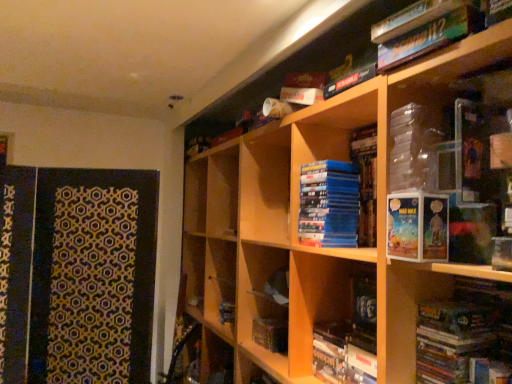
What is the approximate width of green cardboard book at upper right, acting as the first book starting from the top?

It is 15.15 inches.

What do you see at coordinates (349, 339) in the screenshot? I see `matte blue book at lower center, which is the fourth book in top-to-bottom order` at bounding box center [349, 339].

The height and width of the screenshot is (384, 512). What do you see at coordinates (355, 232) in the screenshot? I see `wooden bookcase at upper right` at bounding box center [355, 232].

Find the location of `green cardboard book at upper right, acting as the 4th book starting from the bottom`. green cardboard book at upper right, acting as the 4th book starting from the bottom is located at coordinates (426, 31).

Which point is more forward, (467, 316) or (357, 362)?

The point (467, 316) is closer to the camera.

Is matte black book at lower right, which ranks as the second book in bottom-to-top order, beside matte blue book at lower center, which is the fourth book in top-to-bottom order?

No, matte black book at lower right, which ranks as the second book in bottom-to-top order, is not beside matte blue book at lower center, which is the fourth book in top-to-bottom order.

Between matte black book at lower right, placed as the 3th book when sorted from top to bottom, and matte blue book at lower center, which is the fourth book in top-to-bottom order, which one has smaller size?

matte blue book at lower center, which is the fourth book in top-to-bottom order, is smaller.

From their relative heights in the image, would you say matte black book at lower right, which ranks as the second book in bottom-to-top order, is taller or shorter than matte blue book at lower center, which is the fourth book in top-to-bottom order?

matte black book at lower right, which ranks as the second book in bottom-to-top order, is taller than matte blue book at lower center, which is the fourth book in top-to-bottom order.

Could matte black book at lower right, placed as the 3th book when sorted from top to bottom, be considered to be inside matte cardboard book at center-right?

No, matte black book at lower right, placed as the 3th book when sorted from top to bottom, is not surrounded by matte cardboard book at center-right.

From the image's perspective, is matte cardboard book at center-right on matte black book at lower right, placed as the 3th book when sorted from top to bottom?

Yes, from the image's perspective, matte cardboard book at center-right is on top of matte black book at lower right, placed as the 3th book when sorted from top to bottom.

Which of these two, matte cardboard book at center-right or matte black book at lower right, which ranks as the second book in bottom-to-top order, is thinner?

With smaller width is matte black book at lower right, which ranks as the second book in bottom-to-top order.

Which of these two, blue matte dvd stack at center, acting as the third book starting from the bottom, or green cardboard book at upper right, acting as the first book starting from the top, is smaller?

green cardboard book at upper right, acting as the first book starting from the top, is smaller.

Would you say green cardboard book at upper right, acting as the first book starting from the top, is part of blue matte dvd stack at center, acting as the third book starting from the bottom,'s contents?

No, green cardboard book at upper right, acting as the first book starting from the top, is not a part of blue matte dvd stack at center, acting as the third book starting from the bottom.

Which is behind, blue matte dvd stack at center, placed as the second book when sorted from top to bottom, or green cardboard book at upper right, acting as the 4th book starting from the bottom?

blue matte dvd stack at center, placed as the second book when sorted from top to bottom, is more distant.

From the image's perspective, which book is the 1st one below the green cardboard book at upper right, acting as the 4th book starting from the bottom? Please provide its 2D coordinates.

[(366, 182)]

Is matte blue book at lower center, the 1th book positioned from the bottom, completely or partially inside wooden bookcase at upper right?

Yes, matte blue book at lower center, the 1th book positioned from the bottom, is a part of wooden bookcase at upper right.

Is point (470, 353) farther from viewer compared to point (352, 358)?

No, (470, 353) is in front of (352, 358).

Does wooden bookcase at upper right have a greater width compared to matte blue book at lower center, which is the fourth book in top-to-bottom order?

Indeed, wooden bookcase at upper right has a greater width compared to matte blue book at lower center, which is the fourth book in top-to-bottom order.

From the image's perspective, is wooden bookcase at upper right above or below matte blue book at lower center, the 1th book positioned from the bottom?

wooden bookcase at upper right is situated higher than matte blue book at lower center, the 1th book positioned from the bottom, in the image.

Does green cardboard book at upper right, acting as the 4th book starting from the bottom, have a lesser width compared to matte blue book at lower center, which is the fourth book in top-to-bottom order?

In fact, green cardboard book at upper right, acting as the 4th book starting from the bottom, might be wider than matte blue book at lower center, which is the fourth book in top-to-bottom order.

Is green cardboard book at upper right, acting as the first book starting from the top, aimed at matte blue book at lower center, the 1th book positioned from the bottom?

No, green cardboard book at upper right, acting as the first book starting from the top, is not oriented towards matte blue book at lower center, the 1th book positioned from the bottom.

From a real-world perspective, is green cardboard book at upper right, acting as the first book starting from the top, under matte blue book at lower center, the 1th book positioned from the bottom?

No, from a real-world perspective, green cardboard book at upper right, acting as the first book starting from the top, is not beneath matte blue book at lower center, the 1th book positioned from the bottom.

Consider the image. Between green cardboard book at upper right, acting as the 4th book starting from the bottom, and matte blue book at lower center, the 1th book positioned from the bottom, which one has smaller size?

With smaller size is matte blue book at lower center, the 1th book positioned from the bottom.

From the image's perspective, which is above, matte blue book at lower center, the 1th book positioned from the bottom, or blue matte dvd stack at center, acting as the third book starting from the bottom?

blue matte dvd stack at center, acting as the third book starting from the bottom, from the image's perspective.

Between point (366, 354) and point (355, 157), which one is positioned in front?

The point (366, 354) is closer.

From the picture: Could you tell me if matte blue book at lower center, which is the fourth book in top-to-bottom order, is turned towards blue matte dvd stack at center, placed as the second book when sorted from top to bottom?

No.

Does blue matte dvd stack at center, acting as the third book starting from the bottom, have a lesser width compared to matte black book at lower right, placed as the 3th book when sorted from top to bottom?

In fact, blue matte dvd stack at center, acting as the third book starting from the bottom, might be wider than matte black book at lower right, placed as the 3th book when sorted from top to bottom.

From a real-world perspective, is blue matte dvd stack at center, placed as the second book when sorted from top to bottom, located beneath matte black book at lower right, which ranks as the second book in bottom-to-top order?

Actually, blue matte dvd stack at center, placed as the second book when sorted from top to bottom, is physically above matte black book at lower right, which ranks as the second book in bottom-to-top order, in the real world.

Is blue matte dvd stack at center, acting as the third book starting from the bottom, aimed at matte black book at lower right, placed as the 3th book when sorted from top to bottom?

No, blue matte dvd stack at center, acting as the third book starting from the bottom, is not aimed at matte black book at lower right, placed as the 3th book when sorted from top to bottom.

In order to click on the 1st book above the matte blue book at lower center, which is the fourth book in top-to-bottom order (from the image's perspective) in this screenshot , I will do `click(463, 330)`.

Locate an element on the screen. This screenshot has width=512, height=384. the 1st book positioned below the matte cardboard book at center-right (from the image's perspective) is located at coordinates (463, 330).

Looking at the image, which one is located closer to blue matte dvd stack at center, placed as the second book when sorted from top to bottom, matte cardboard book at center-right or wooden bookcase at upper right?

Among the two, wooden bookcase at upper right is located nearer to blue matte dvd stack at center, placed as the second book when sorted from top to bottom.

When comparing their distances from wooden bookcase at upper right, does matte blue book at lower center, the 1th book positioned from the bottom, or blue matte dvd stack at center, acting as the third book starting from the bottom, seem further?

Among the two, blue matte dvd stack at center, acting as the third book starting from the bottom, is located further to wooden bookcase at upper right.

Estimate the real-world distances between objects in this image. Which object is further from green cardboard book at upper right, acting as the 4th book starting from the bottom, matte cardboard book at center-right or matte blue book at lower center, the 1th book positioned from the bottom?

The object further to green cardboard book at upper right, acting as the 4th book starting from the bottom, is matte blue book at lower center, the 1th book positioned from the bottom.

When comparing their distances from matte black book at lower right, which ranks as the second book in bottom-to-top order, does matte blue book at lower center, which is the fourth book in top-to-bottom order, or blue matte dvd stack at center, placed as the second book when sorted from top to bottom, seem closer?

matte blue book at lower center, which is the fourth book in top-to-bottom order, is closer to matte black book at lower right, which ranks as the second book in bottom-to-top order.

Looking at the image, which one is located closer to green cardboard book at upper right, acting as the 4th book starting from the bottom, blue matte dvd stack at center, placed as the second book when sorted from top to bottom, or matte cardboard book at center-right?

Based on the image, matte cardboard book at center-right appears to be nearer to green cardboard book at upper right, acting as the 4th book starting from the bottom.

From the image, which object appears to be farther from matte black book at lower right, placed as the 3th book when sorted from top to bottom, matte blue book at lower center, the 1th book positioned from the bottom, or green cardboard book at upper right, acting as the first book starting from the top?

The object further to matte black book at lower right, placed as the 3th book when sorted from top to bottom, is green cardboard book at upper right, acting as the first book starting from the top.

When comparing their distances from wooden bookcase at upper right, does green cardboard book at upper right, acting as the first book starting from the top, or matte cardboard book at center-right seem closer?

matte cardboard book at center-right is closer to wooden bookcase at upper right.

Which object lies nearer to the anchor point matte cardboard book at center-right, blue matte dvd stack at center, placed as the second book when sorted from top to bottom, or matte blue book at lower center, the 1th book positioned from the bottom?

Among the two, matte blue book at lower center, the 1th book positioned from the bottom, is located nearer to matte cardboard book at center-right.

I want to click on paperback book between green cardboard book at upper right, acting as the 4th book starting from the bottom, and wooden bookcase at upper right in the up-down direction, so click(417, 227).

Where is `bookcase that lies between green cardboard book at upper right, acting as the first book starting from the top, and matte blue book at lower center, the 1th book positioned from the bottom, from top to bottom`? This screenshot has height=384, width=512. bookcase that lies between green cardboard book at upper right, acting as the first book starting from the top, and matte blue book at lower center, the 1th book positioned from the bottom, from top to bottom is located at coordinates (355, 232).

You are a GUI agent. You are given a task and a screenshot of the screen. Output one action in this format:
    pyautogui.click(x=<x>, y=<y>)
    Task: Click on the paperback book that lies between green cardboard book at upper right, acting as the 4th book starting from the bottom, and matte black book at lower right, which ranks as the second book in bottom-to-top order, from top to bottom
    Image resolution: width=512 pixels, height=384 pixels.
    Given the screenshot: What is the action you would take?
    [417, 227]

This screenshot has width=512, height=384. I want to click on paperback book between wooden bookcase at upper right and matte blue book at lower center, which is the fourth book in top-to-bottom order, along the z-axis, so click(417, 227).